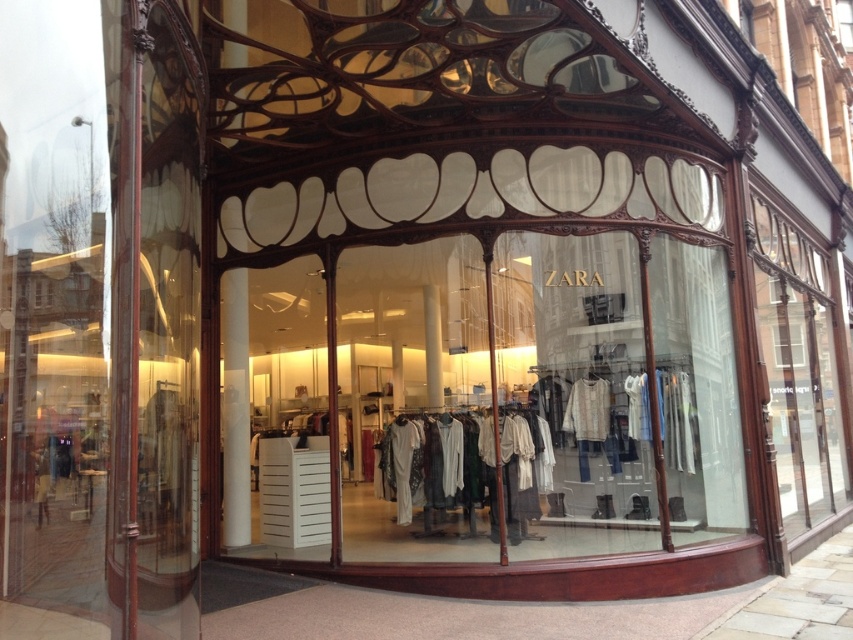
You are a customer standing at the entrance of the Zara store. You want to check the price tag of the white cotton shirts at center but need to avoid touching the clear glass window at upper right. Can you safely walk straight towards the shirts without hitting the window?

The clear glass window at upper right is 4.27 meters away from the white cotton shirts at center, so walking straight towards the shirts would not bring you close to the window. Therefore, you can safely walk straight without hitting the window.